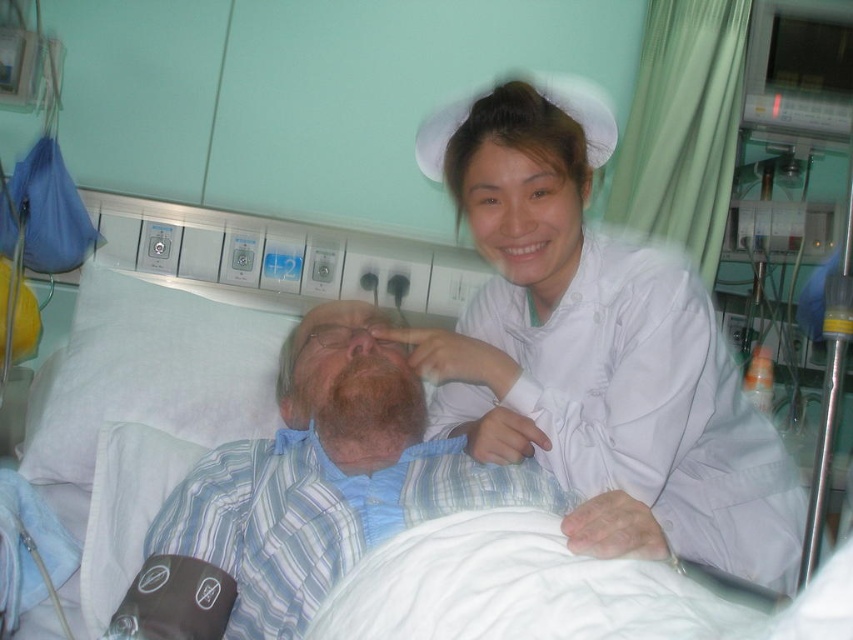
Which is below, white smooth nurse cap at upper center or blue striped shirt at center?

Positioned lower is blue striped shirt at center.

In the scene shown: Can you confirm if white smooth nurse cap at upper center is thinner than blue striped shirt at center?

In fact, white smooth nurse cap at upper center might be wider than blue striped shirt at center.

What do you see at coordinates (596, 349) in the screenshot? I see `white smooth nurse cap at upper center` at bounding box center [596, 349].

Locate an element on the screen. The height and width of the screenshot is (640, 853). white smooth nurse cap at upper center is located at coordinates (596, 349).

What do you see at coordinates (596, 349) in the screenshot?
I see `white smooth nurse cap at upper center` at bounding box center [596, 349].

This screenshot has width=853, height=640. What do you see at coordinates (596, 349) in the screenshot?
I see `white smooth nurse cap at upper center` at bounding box center [596, 349].

Locate an element on the screen. white smooth nurse cap at upper center is located at coordinates (596, 349).

Can you confirm if white fabric hospital bed at center is smaller than blue striped shirt at center?

No, white fabric hospital bed at center is not smaller than blue striped shirt at center.

Is white fabric hospital bed at center positioned at the back of blue striped shirt at center?

Yes, white fabric hospital bed at center is behind blue striped shirt at center.

Does point (64, 497) come farther from viewer compared to point (325, 586)?

That is True.

You are a GUI agent. You are given a task and a screenshot of the screen. Output one action in this format:
    pyautogui.click(x=<x>, y=<y>)
    Task: Click on the white fabric hospital bed at center
    The width and height of the screenshot is (853, 640).
    Given the screenshot: What is the action you would take?
    pyautogui.click(x=175, y=364)